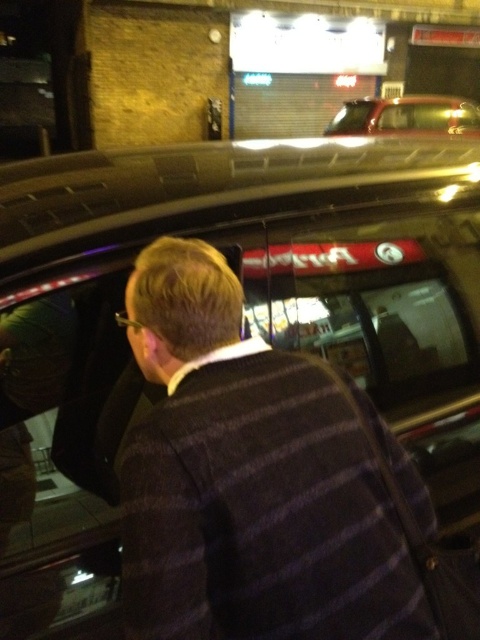
Question: Observing the image, what is the correct spatial positioning of dark striped sweater at center in reference to metallic gold car at upper center?

Choices:
 (A) right
 (B) left

Answer: (B)

Question: Observing the image, what is the correct spatial positioning of dark striped sweater at center in reference to metallic gold car at upper center?

Choices:
 (A) left
 (B) right

Answer: (A)

Question: Which object is closer to the camera taking this photo?

Choices:
 (A) metallic gold car at upper center
 (B) dark striped sweater at center

Answer: (B)

Question: Which point is farther to the camera?

Choices:
 (A) (229, 376)
 (B) (358, 106)

Answer: (B)

Question: Is dark striped sweater at center further to the viewer compared to metallic gold car at upper center?

Choices:
 (A) yes
 (B) no

Answer: (B)